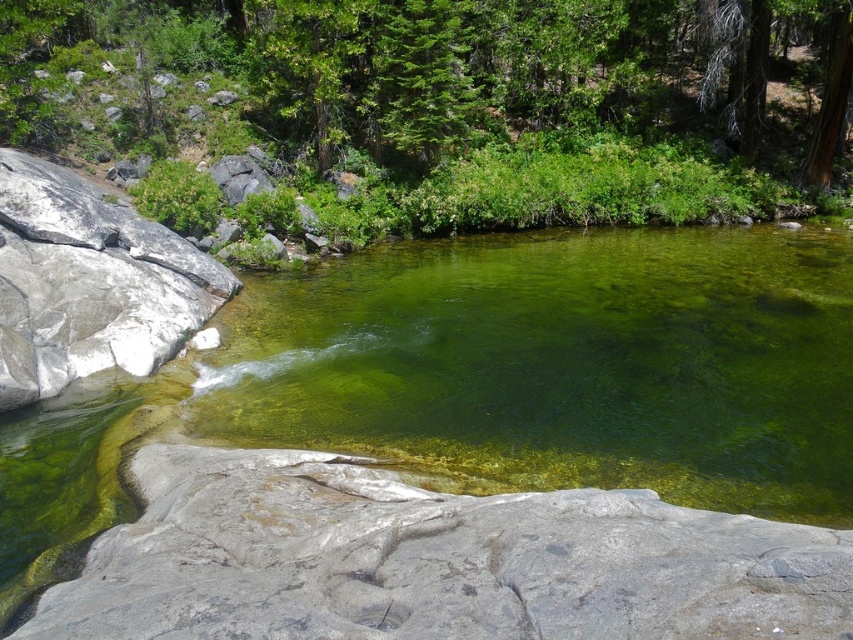
Question: Which of the following is the closest to the observer?

Choices:
 (A) green translucent water at center
 (B) gray rock at center

Answer: (A)

Question: Is green translucent water at center thinner than gray rock at left?

Choices:
 (A) yes
 (B) no

Answer: (B)

Question: Is green translucent water at center to the left of gray rock at left from the viewer's perspective?

Choices:
 (A) no
 (B) yes

Answer: (A)

Question: Among these points, which one is farthest from the camera?

Choices:
 (A) (26, 204)
 (B) (610, 304)
 (C) (189, 481)

Answer: (B)

Question: Which point is closer to the camera?

Choices:
 (A) gray rock at left
 (B) green translucent water at center
 (C) gray rock at center

Answer: (B)

Question: Can you confirm if green translucent water at center is positioned below gray rock at left?

Choices:
 (A) yes
 (B) no

Answer: (A)